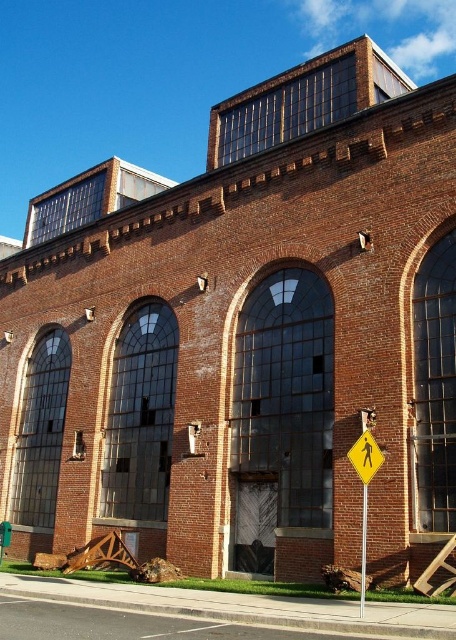
Question: Which point is farther to the camera?

Choices:
 (A) (358, 440)
 (B) (362, 602)

Answer: (A)

Question: Which of the following is the closest to the observer?

Choices:
 (A) metallic pole at right
 (B) yellow reflective plastic pedestrian crossing sign at lower right

Answer: (A)

Question: Is yellow reflective plastic pedestrian crossing sign at lower right to the right of metallic pole at right from the viewer's perspective?

Choices:
 (A) no
 (B) yes

Answer: (A)

Question: Can you confirm if yellow reflective plastic pedestrian crossing sign at lower right is positioned to the left of metallic pole at right?

Choices:
 (A) no
 (B) yes

Answer: (B)

Question: Can you confirm if yellow reflective plastic pedestrian crossing sign at lower right is bigger than metallic pole at right?

Choices:
 (A) yes
 (B) no

Answer: (B)